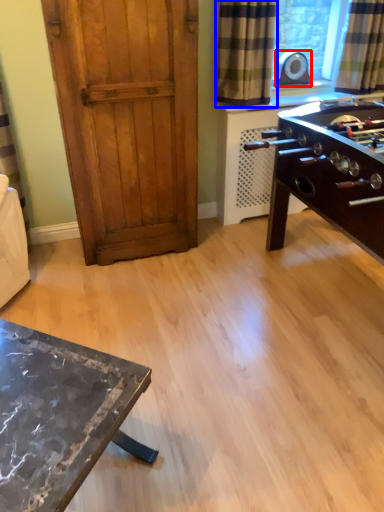
Question: Which point is further to the camera, appliance (highlighted by a red box) or curtain (highlighted by a blue box)?

Choices:
 (A) appliance
 (B) curtain

Answer: (A)